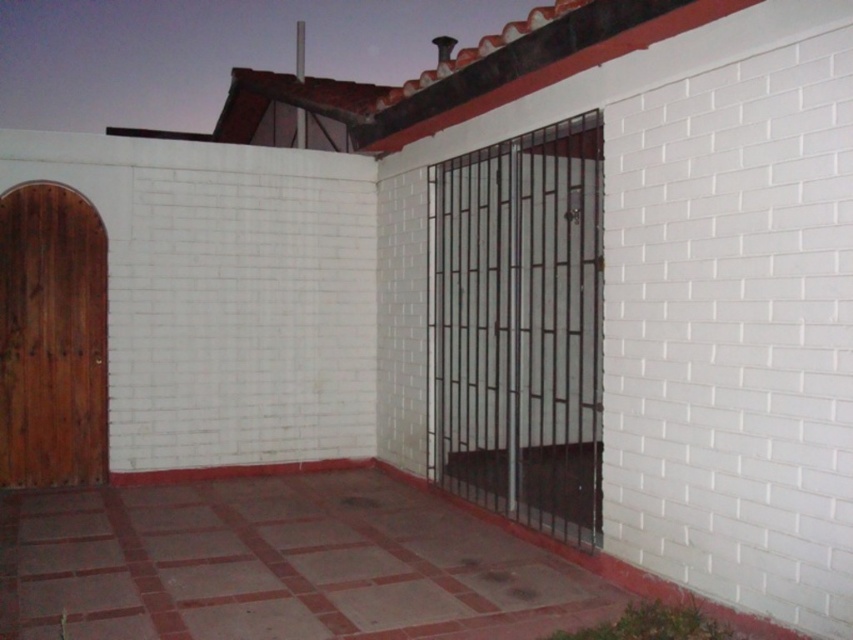
Who is positioned more to the left, metallic gate at center or wooden door at left?

From the viewer's perspective, wooden door at left appears more on the left side.

Between metallic gate at center and wooden door at left, which one has less height?

wooden door at left is shorter.

Which is behind, point (434, 220) or point (24, 252)?

The point (434, 220) is behind.

This screenshot has width=853, height=640. Find the location of `metallic gate at center`. metallic gate at center is located at coordinates (519, 326).